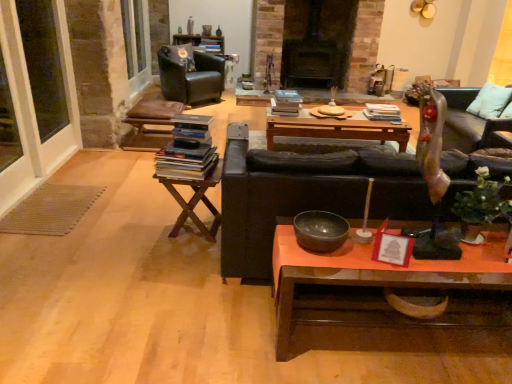
Find the location of a particular element. free region on the left part of hardcover book at center, which ranks as the second book in top-to-bottom order is located at coordinates coord(352,118).